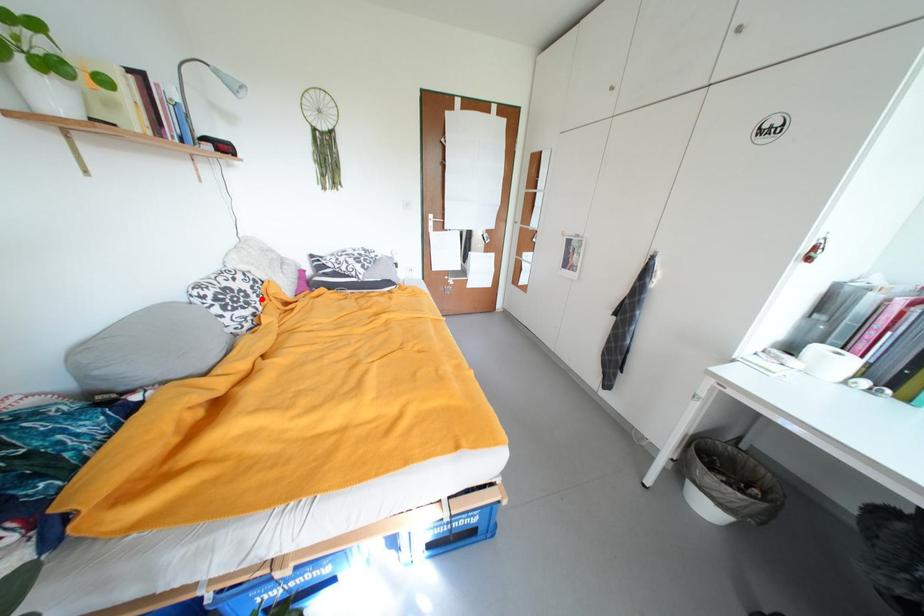
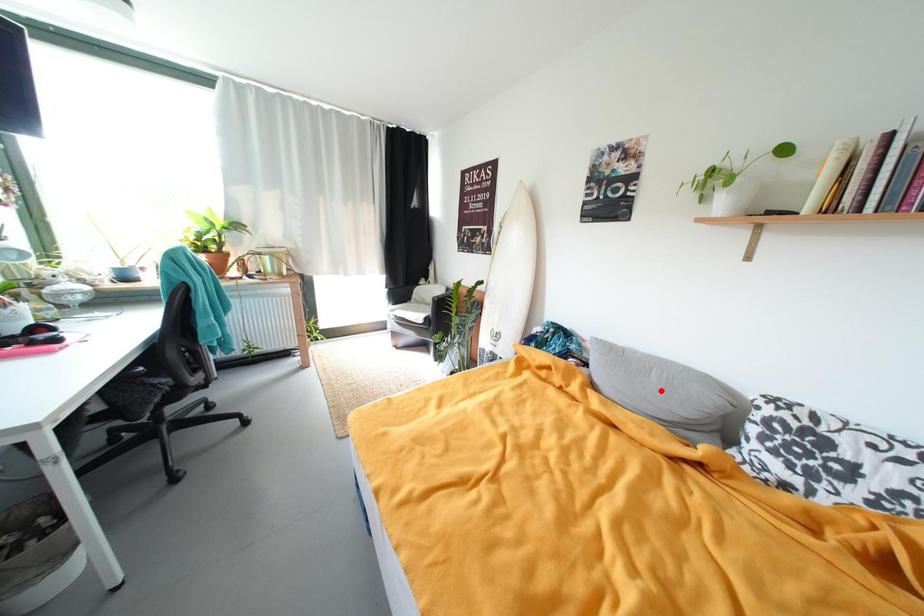
I am providing you with two images of the same scene from different viewpoints. A red point is marked on the first image and another point is marked on the second image. Is the red point in image1 aligned with the point shown in image2?

No